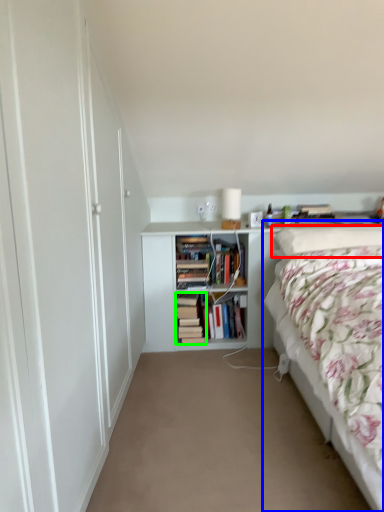
Question: Based on their relative distances, which object is farther from pillow (highlighted by a red box)? Choose from bed (highlighted by a blue box) and book (highlighted by a green box).

Choices:
 (A) bed
 (B) book

Answer: (B)